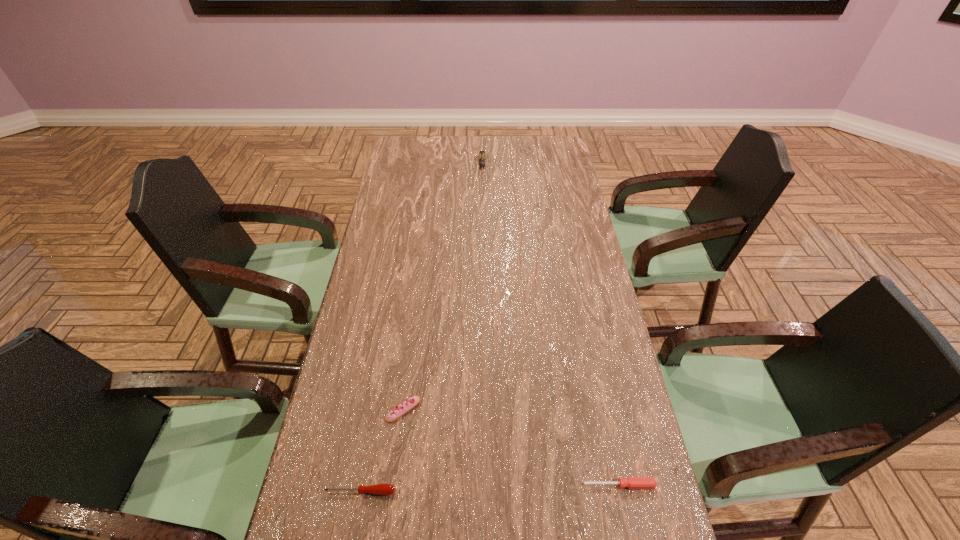
Choose which screwdriver is the second nearest neighbor to the second farthest object. Please provide its 2D coordinates. Your answer should be formatted as a tuple, i.e. [(x, y)], where the tuple contains the x and y coordinates of a point satisfying the conditions above.

[(631, 482)]

You are a GUI agent. You are given a task and a screenshot of the screen. Output one action in this format:
    pyautogui.click(x=<x>, y=<y>)
    Task: Click on the free spot that satisfies the following two spatial constraints: 1. insert the farthest object into a screw head; 2. on the right side of the rightmost screwdriver
    
    Given the screenshot: What is the action you would take?
    pyautogui.click(x=484, y=485)

Image resolution: width=960 pixels, height=540 pixels. I want to click on vacant region that satisfies the following two spatial constraints: 1. on the back side of the leftmost screwdriver; 2. on the left side of the rightmost screwdriver, so click(362, 485).

What are the coordinates of `free spot that satisfies the following two spatial constraints: 1. insert the second screwdriver from left to right into a screw head; 2. on the right side of the rightmost object` in the screenshot? It's located at (484, 485).